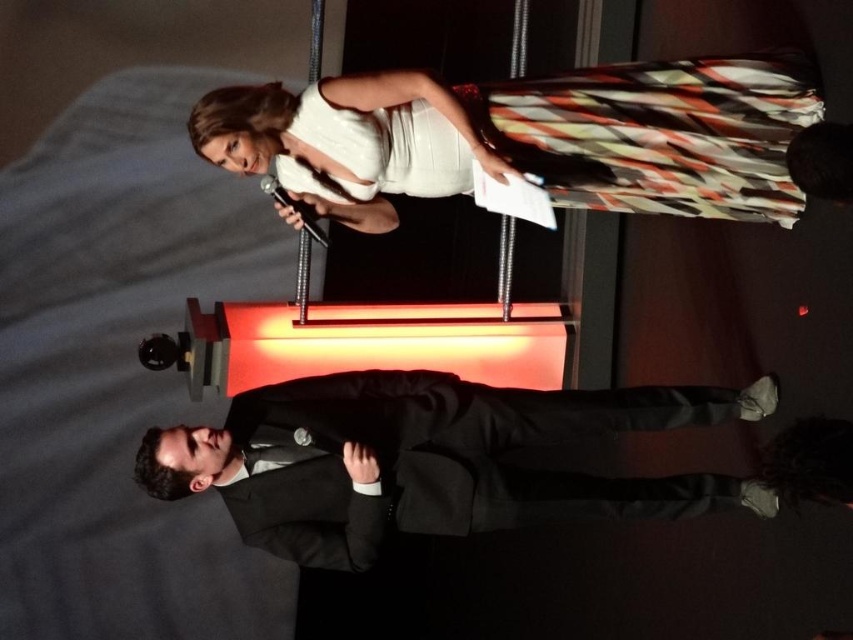
Is white satin dress at upper center further to camera compared to black woolen suit at center?

No, white satin dress at upper center is closer to the viewer.

Does white satin dress at upper center have a smaller size compared to black woolen suit at center?

Incorrect, white satin dress at upper center is not smaller in size than black woolen suit at center.

Is point (776, 164) farther from viewer compared to point (610, 513)?

No, (776, 164) is in front of (610, 513).

What are the coordinates of `white satin dress at upper center` in the screenshot? It's located at (543, 140).